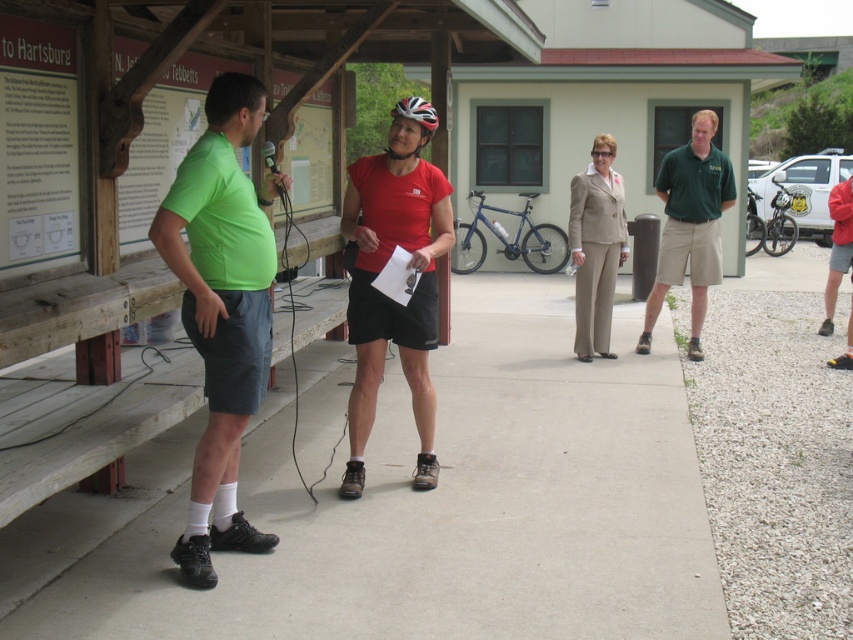
Can you confirm if gray concrete pavement at center is positioned above green cotton polo shirt at right?

Actually, gray concrete pavement at center is below green cotton polo shirt at right.

Is gray concrete pavement at center positioned in front of green cotton polo shirt at right?

Yes.

Does point (451, 381) lie behind point (715, 115)?

That is False.

Where is `gray concrete pavement at center`? gray concrete pavement at center is located at coordinates (419, 509).

Which of these two, gray concrete pavement at center or white glossy bicycle helmet at center, stands taller?

With more height is white glossy bicycle helmet at center.

Does gray concrete pavement at center have a smaller size compared to white glossy bicycle helmet at center?

Indeed, gray concrete pavement at center has a smaller size compared to white glossy bicycle helmet at center.

Which is behind, point (331, 625) or point (426, 109)?

Point (426, 109)

Identify the location of gray concrete pavement at center. The image size is (853, 640). (419, 509).

Who is lower down, beige fabric suit at center or white glossy bicycle helmet at center?

beige fabric suit at center

Does beige fabric suit at center have a greater height compared to white glossy bicycle helmet at center?

Yes, beige fabric suit at center is taller than white glossy bicycle helmet at center.

You are a GUI agent. You are given a task and a screenshot of the screen. Output one action in this format:
    pyautogui.click(x=<x>, y=<y>)
    Task: Click on the beige fabric suit at center
    Image resolution: width=853 pixels, height=640 pixels.
    Given the screenshot: What is the action you would take?
    pyautogui.click(x=596, y=248)